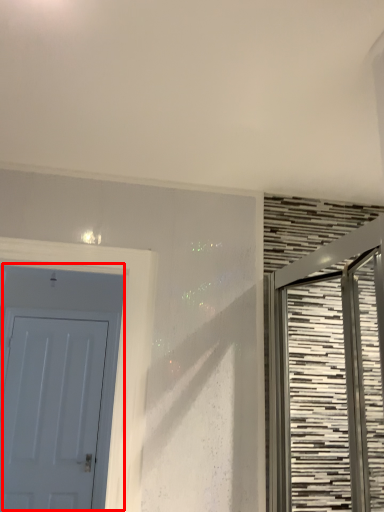
Question: Where is door (annotated by the red box) located in relation to door in the image?

Choices:
 (A) left
 (B) right

Answer: (A)